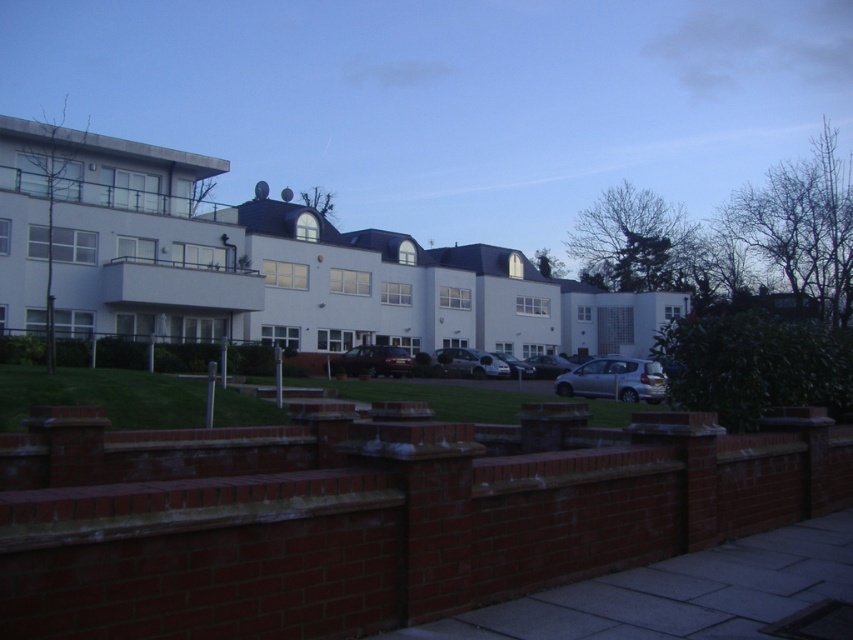
Can you confirm if silver metallic car at lower right is shorter than metallic silver car at center?

Incorrect, silver metallic car at lower right's height does not fall short of metallic silver car at center's.

Who is higher up, silver metallic car at lower right or metallic silver car at center?

silver metallic car at lower right is higher up.

Who is more forward, (636,384) or (469,349)?

Positioned in front is point (636,384).

This screenshot has width=853, height=640. I want to click on silver metallic car at lower right, so click(x=614, y=380).

The width and height of the screenshot is (853, 640). I want to click on silver metallic car at lower right, so click(614, 380).

Who is more forward, (608,356) or (527,364)?

Point (608,356) is more forward.

This screenshot has height=640, width=853. What are the coordinates of `silver metallic car at lower right` in the screenshot? It's located at pos(614,380).

Does satin black car at center have a smaller size compared to satin silver car at center?

Yes.

Does satin black car at center have a lesser height compared to satin silver car at center?

Indeed, satin black car at center has a lesser height compared to satin silver car at center.

Is point (366, 365) less distant than point (514, 362)?

Yes.

The image size is (853, 640). Find the location of `satin black car at center`. satin black car at center is located at coordinates (372, 362).